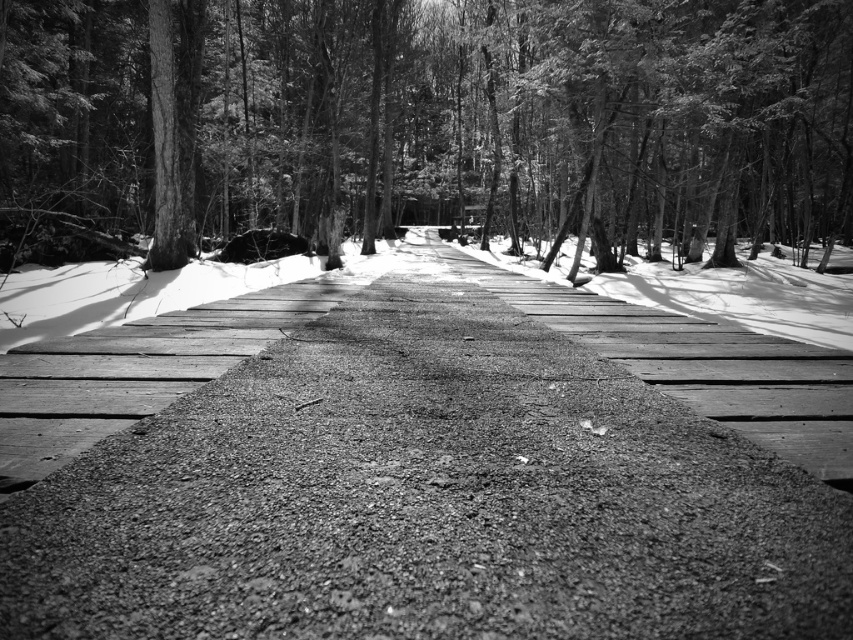
Consider the image. Can you confirm if smooth bark tree at center is positioned above gravelly asphalt path at center?

Yes, smooth bark tree at center is above gravelly asphalt path at center.

Is smooth bark tree at center positioned in front of gravelly asphalt path at center?

No, it is not.

Where is `smooth bark tree at center`? The width and height of the screenshot is (853, 640). smooth bark tree at center is located at coordinates (422, 122).

Locate an element on the screen. smooth bark tree at center is located at coordinates [422, 122].

What do you see at coordinates (424, 468) in the screenshot? This screenshot has width=853, height=640. I see `dull asphalt road at center` at bounding box center [424, 468].

Consider the image. Can you confirm if dull asphalt road at center is thinner than gravelly asphalt path at center?

No.

Who is more forward, [132,588] or [761,444]?

Point [132,588] is in front.

Locate an element on the screen. This screenshot has width=853, height=640. dull asphalt road at center is located at coordinates (424, 468).

Is dull asphalt road at center shorter than smooth bark tree at center?

Yes.

Consider the image. Is dull asphalt road at center taller than smooth bark tree at center?

In fact, dull asphalt road at center may be shorter than smooth bark tree at center.

Who is more forward, (x=489, y=268) or (x=32, y=4)?

Point (x=489, y=268)

Find the location of a particular element. dull asphalt road at center is located at coordinates (424, 468).